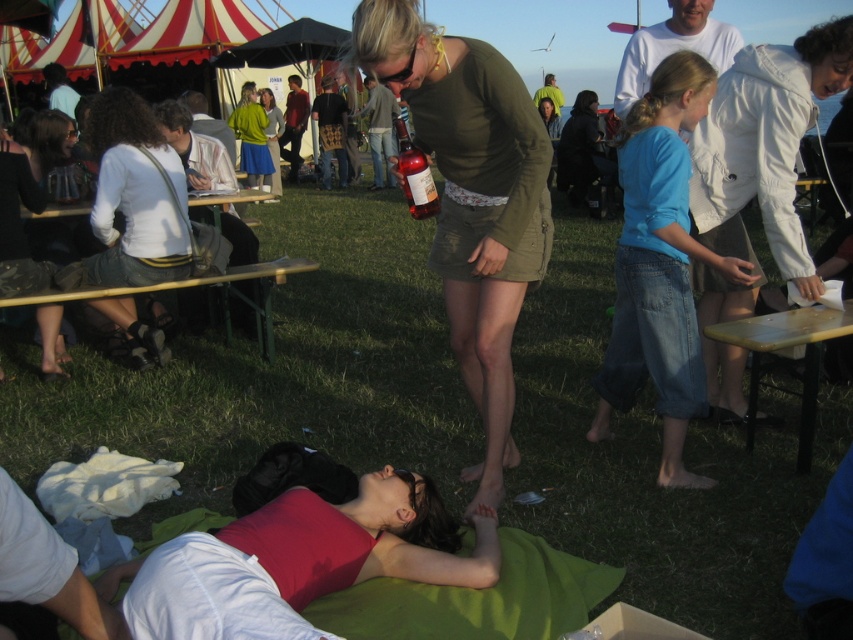
Based on the scene description, where is the green skirt at center located in terms of its 2D coordinates?

The green skirt at center is located at the 2D coordinates of point (271, 138).

Based on the photo, you are standing at the point marked as point [102,163] in the image. You want to take a photo of the woman lying on the blanket. Is the woman lying on the blanket within your camera frame?

The distance of point [102,163] from camera is 4.41 meters. Since the woman lying on the blanket is at the foreground, she is closer to the camera than the point, so she would be outside the camera frame.